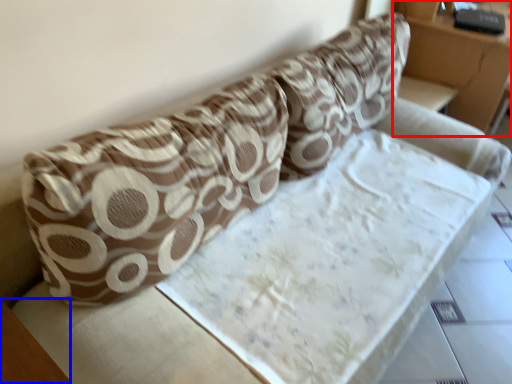
Question: Among these objects, which one is nearest to the camera, furniture (highlighted by a red box) or table (highlighted by a blue box)?

Choices:
 (A) furniture
 (B) table

Answer: (B)